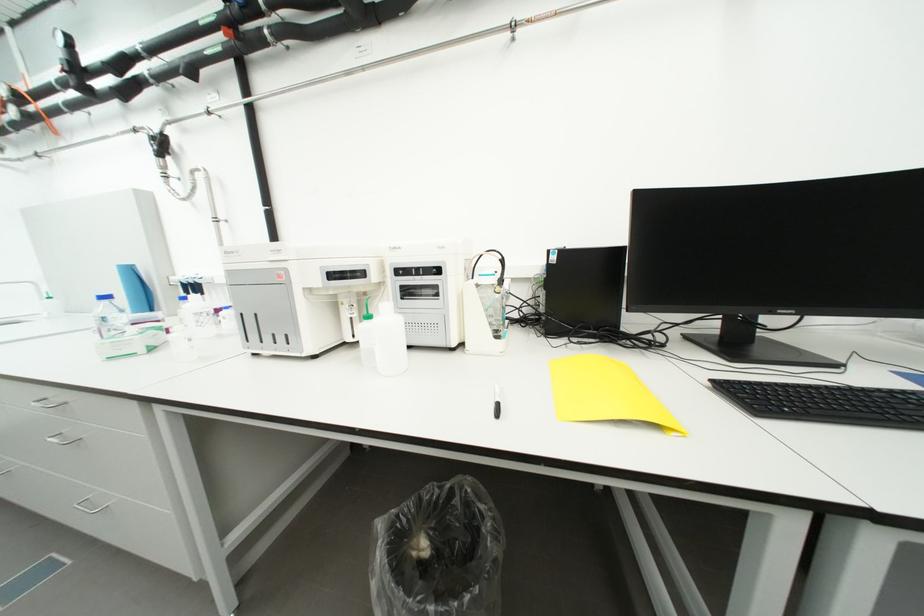
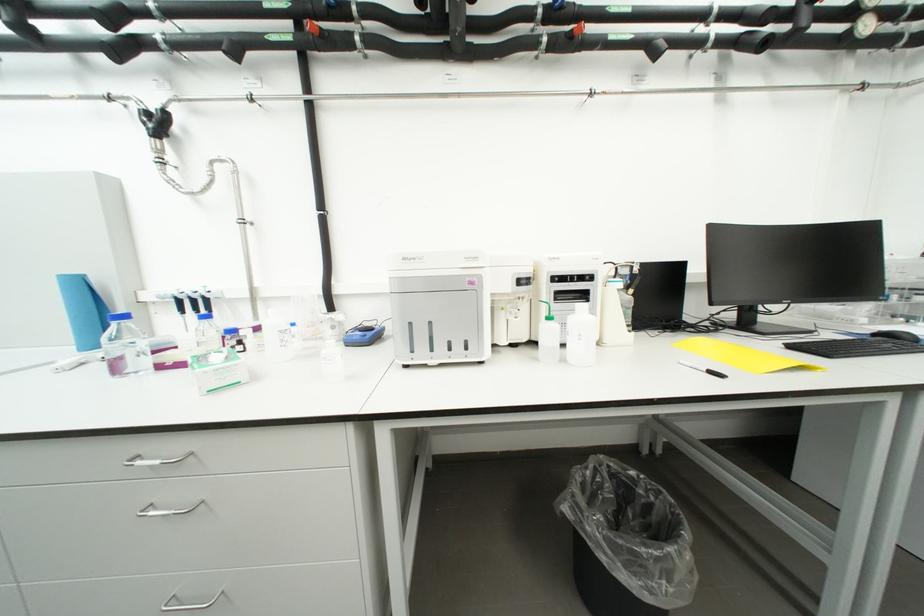
Question: The first image is from the beginning of the video and the second image is from the end. How did the camera likely rotate when shooting the video?

Choices:
 (A) Left
 (B) Right
 (C) Up
 (D) Down

Answer: (B)